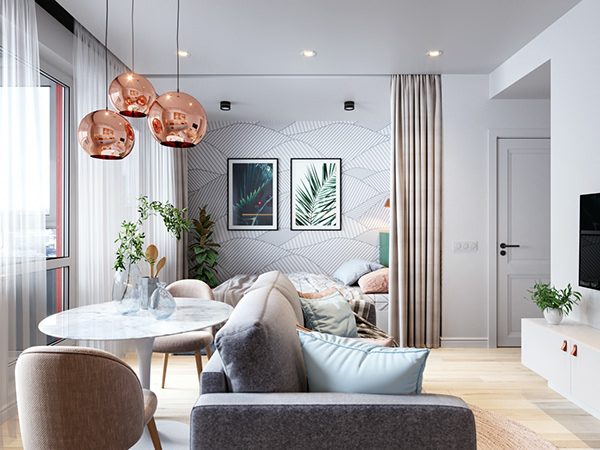
Identify the location of bed pillow. pyautogui.click(x=360, y=263).